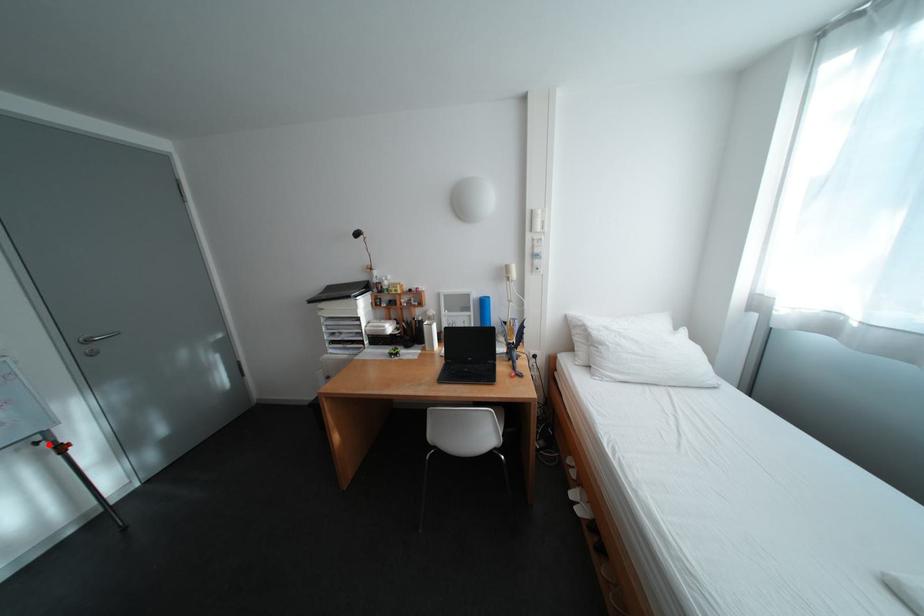
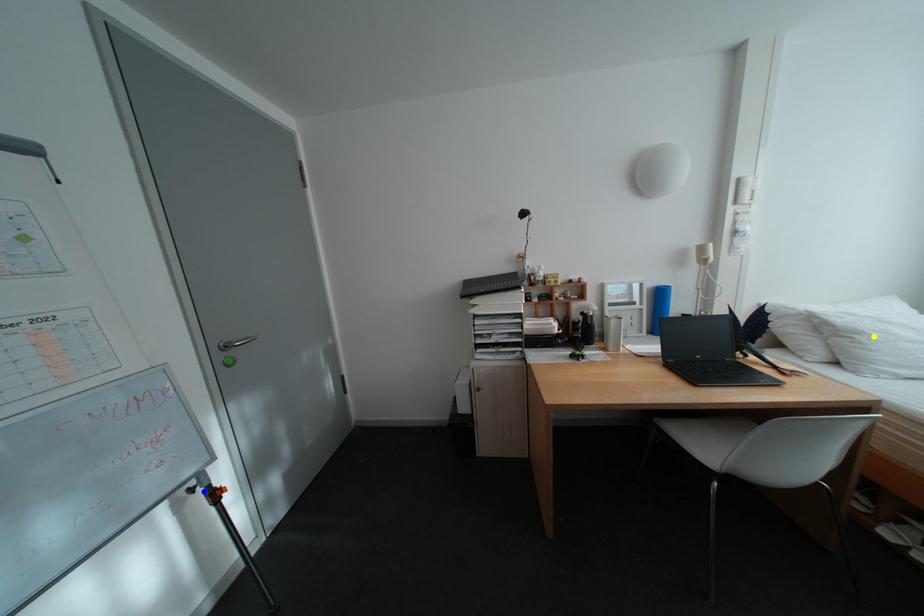
Question: I am providing you with two images of the same scene from different viewpoints. A red point is marked on the first image. You are given multiple points on the second image. Which point in image 2 represents the same 3d spot as the red point in image 1?

Choices:
 (A) yellow point
 (B) green point
 (C) blue point

Answer: (C)